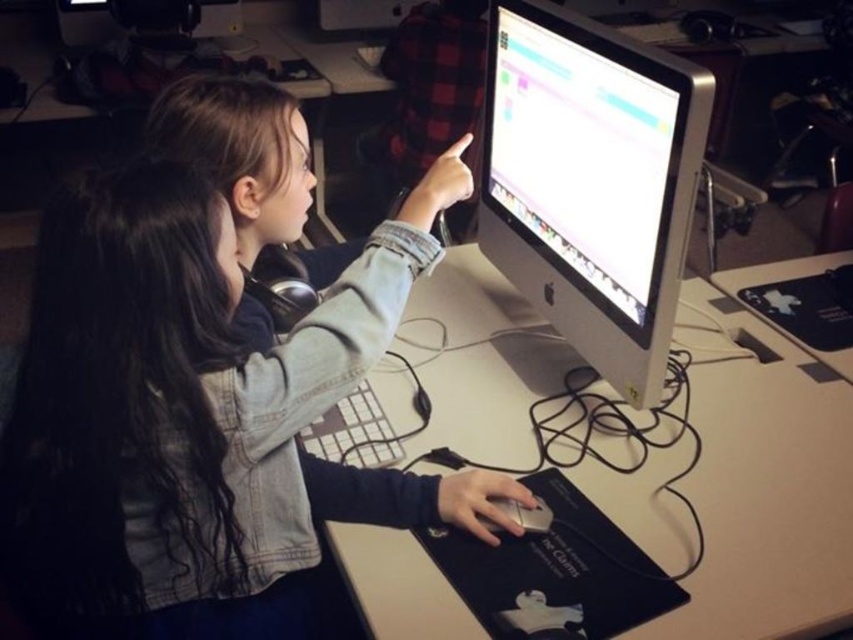
Question: Among these points, which one is farthest from the camera?

Choices:
 (A) (750, 419)
 (B) (612, 99)
 (C) (256, 490)

Answer: (A)

Question: Is white matte table at center thinner than satin silver monitor at center?

Choices:
 (A) no
 (B) yes

Answer: (A)

Question: Which is farther from the denim jacket at center?

Choices:
 (A) white matte table at center
 (B) satin silver monitor at center

Answer: (B)

Question: Is denim jacket at center to the left of satin silver monitor at center from the viewer's perspective?

Choices:
 (A) no
 (B) yes

Answer: (B)

Question: Is denim jacket at center below satin silver monitor at center?

Choices:
 (A) no
 (B) yes

Answer: (B)

Question: Which object appears farthest from the camera in this image?

Choices:
 (A) white matte table at center
 (B) denim jacket at center

Answer: (A)